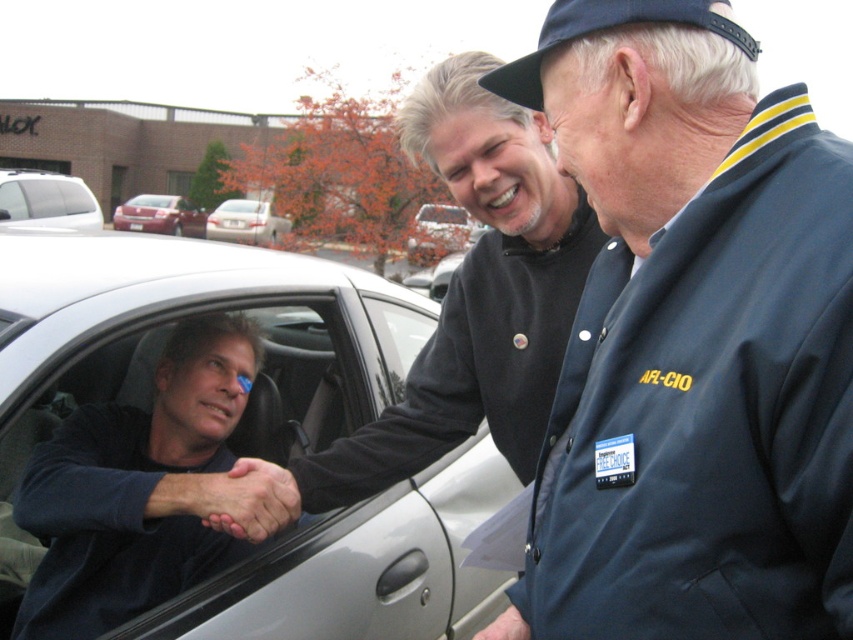
You are a photographer trying to capture the best angle for the handshake between the two individuals. You want to ensure that both points of interest, point (x=280, y=497) and point (x=223, y=237), are clearly visible in your shot. Given their positions relative to the camera, which point should you focus on first to ensure depth of field captures both points effectively?

Point (x=280, y=497) is closer to the camera than point (x=223, y=237). To ensure both points are in focus, you should focus on the closer point, point (x=280, y=497), first as it requires adjusting the depth of field to cover the distance between both points.

In the scene shown: You are a photographer trying to capture a photo of the matte black jacket at center and the smooth skin hand at center. The camera you are using has a limited focus range. Based on their sizes, which object should you focus on first to ensure both are in frame?

The matte black jacket at center is wider than the smooth skin hand at center, so you should focus on the matte black jacket at center first to ensure both fit within the camera frame.

In the scene shown: You are a photographer standing 10 meters away from the smooth skin handshake at center. You want to take a photo of the white glossy sedan at center without moving your position. Is the sedan within your camera lens range if your camera has a maximum zoom range of 10 meters?

The distance between the smooth skin handshake at center and the white glossy sedan at center is 21.29 meters. Since you are 10 meters away from the handshake, the sedan is 11.29 meters away from you. Your camera can only zoom up to 10 meters, so the sedan is outside the camera lens range.